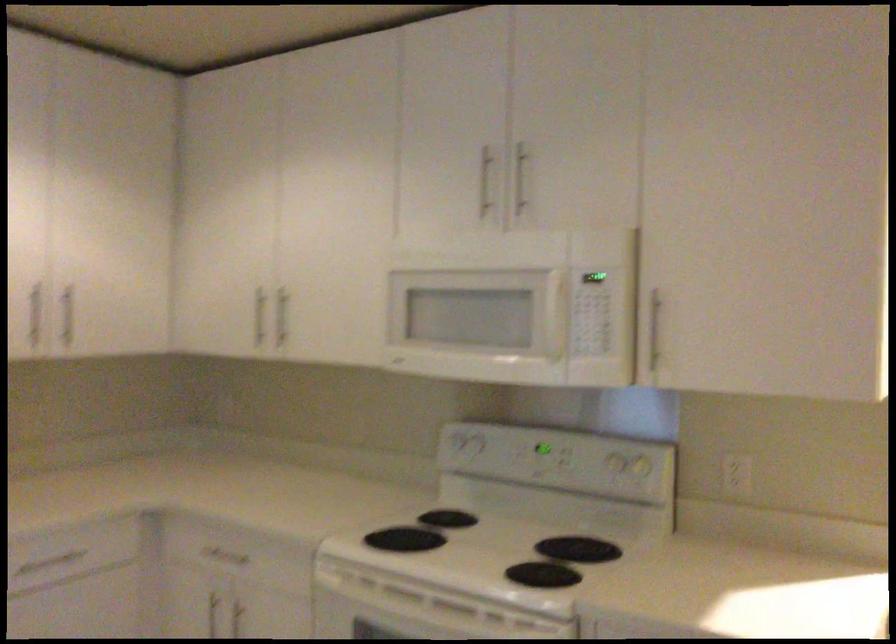
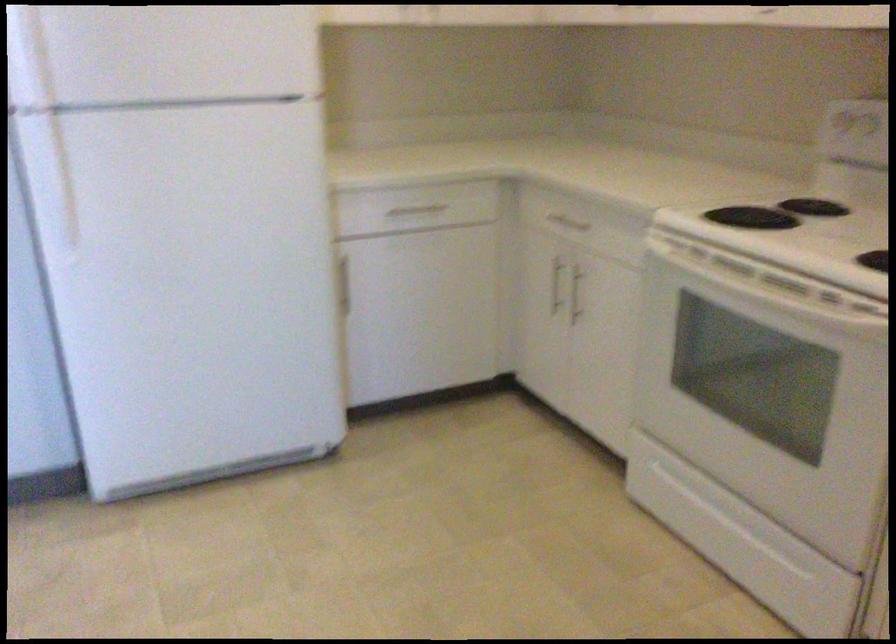
First-person continuous shooting, in which direction is the camera rotating?

The camera rotated toward left-down.